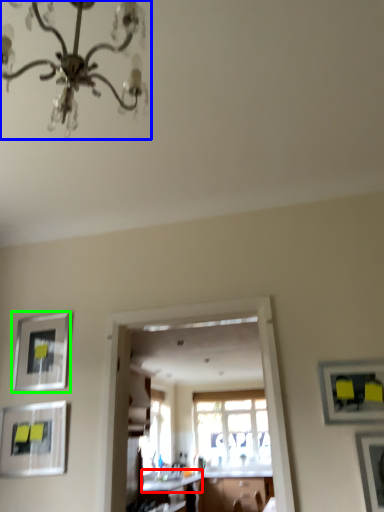
Question: Estimate the real-world distances between objects in this image. Which object is farther from counter top (highlighted by a red box), chandelier (highlighted by a blue box) or picture frame (highlighted by a green box)?

Choices:
 (A) chandelier
 (B) picture frame

Answer: (A)